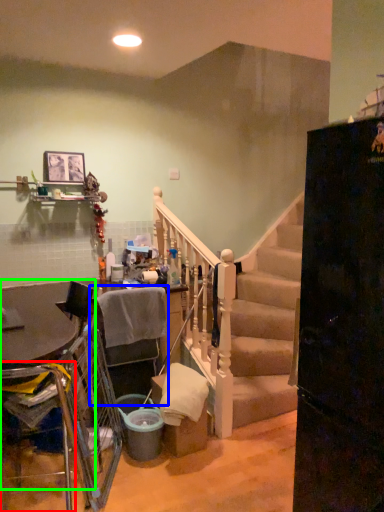
Question: Which object is positioned farthest from armchair (highlighted by a red box)? Select from armchair (highlighted by a blue box) and table (highlighted by a green box).

Choices:
 (A) armchair
 (B) table

Answer: (A)